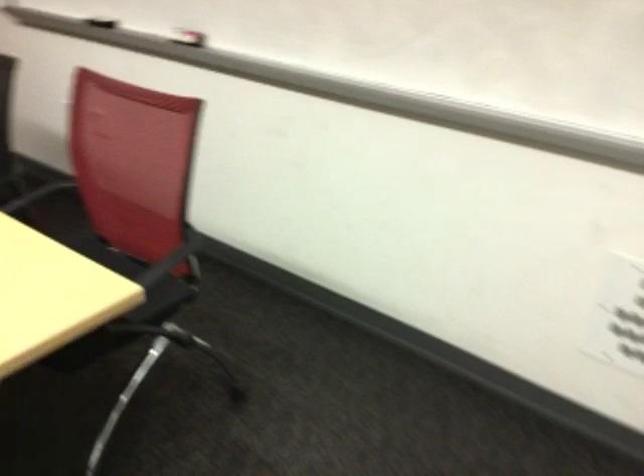
At what (x,y) coordinates should I click in order to perform the action: click on black chair sitting surface. Please return your answer as a coordinate pair (x, y). The height and width of the screenshot is (476, 644). Looking at the image, I should click on (99, 268).